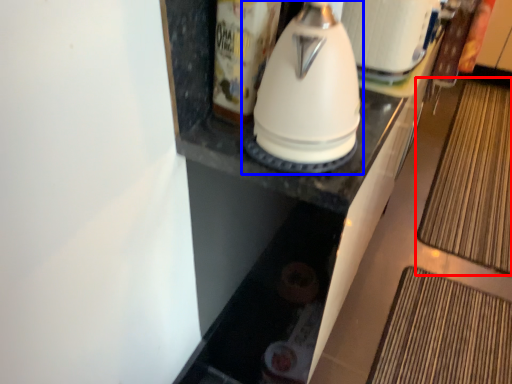
Question: Which object is closer to the camera taking this photo, mat (highlighted by a red box) or kitchen appliance (highlighted by a blue box)?

Choices:
 (A) mat
 (B) kitchen appliance

Answer: (B)